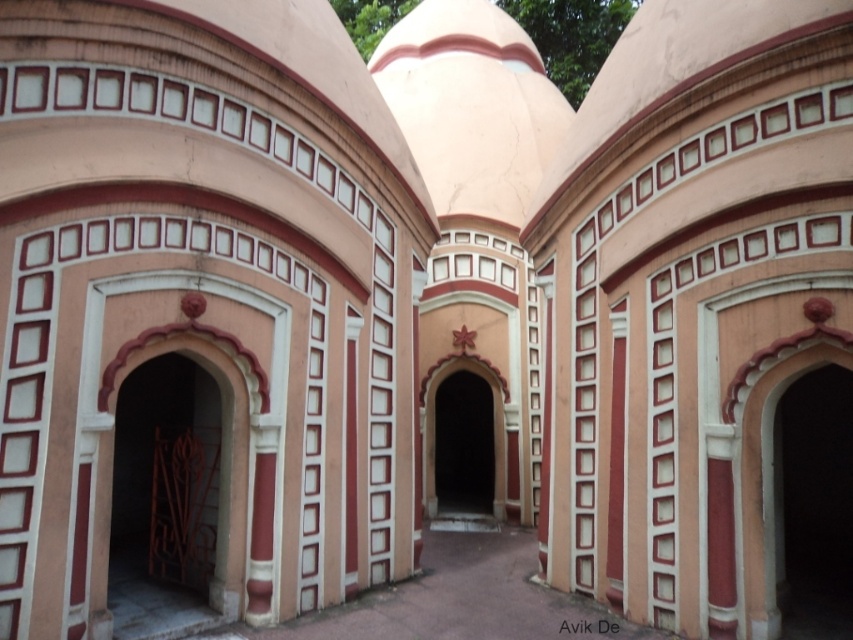
You are an architect analyzing the building facade. You notice the pink stone archway at right and the smooth pink archway at center. Which archway takes up more space on the facade?

The smooth pink archway at center takes up more space on the facade than the pink stone archway at right.

You are a tour guide explaining the building to visitors. You want to mention the size comparison between the polished metal gate at left and the smooth pink archway at center. How do their sizes compare?

The polished metal gate at left is larger in size than the smooth pink archway at center.

You are standing in front of the building and want to enter through the entrance nearest to the polished metal gate at left. Which entrance should you approach? The entrance is either the pink stone archway at right or the central arched entrance mentioned in the scene description.

The entrance nearest to the viewer is the central arched entrance, since the polished metal gate at left is closer to you than the pink stone archway at right, so you should approach the central arched entrance.